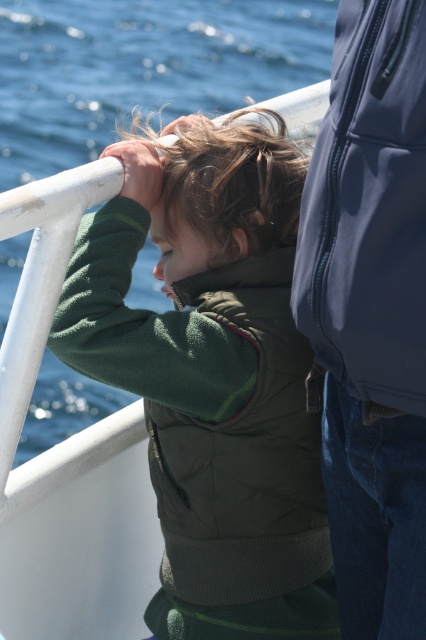
You are a photographer trying to capture the child in the scene. You notice the green fleece jacket at center and the glossy blue jacket at upper right. Which jacket should you focus on to ensure it fits entirely within your camera frame, considering their sizes?

The glossy blue jacket at upper right should be focused on because its width is smaller than the green fleece jacket at center, making it easier to fit entirely within the camera frame.